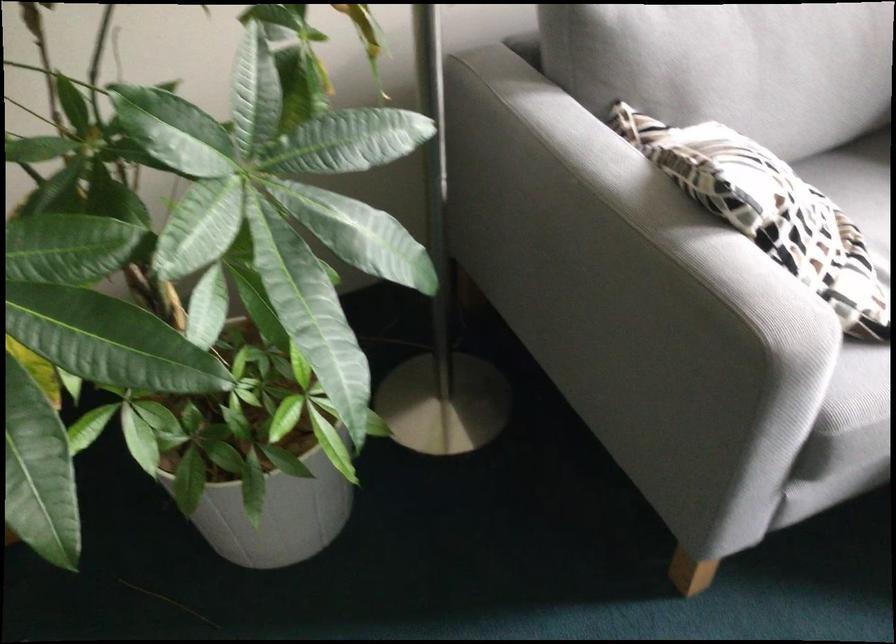
Where would you sit the sofa sitting surface? Please return your answer as a coordinate pair (x, y).

(856, 178)